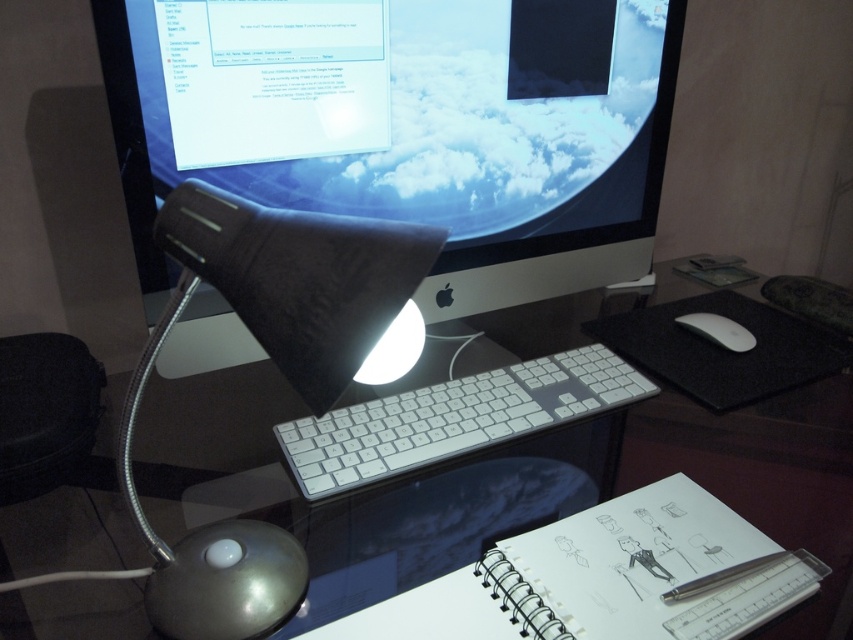
Between white matte mouse at right and metallic silver pen at lower right, which one is positioned higher?

white matte mouse at right

Image resolution: width=853 pixels, height=640 pixels. Describe the element at coordinates (718, 330) in the screenshot. I see `white matte mouse at right` at that location.

In order to click on white matte mouse at right in this screenshot , I will do `click(718, 330)`.

At what (x,y) coordinates should I click in order to perform the action: click on white matte mouse at right. Please return your answer as a coordinate pair (x, y). The width and height of the screenshot is (853, 640). Looking at the image, I should click on (718, 330).

Is the position of white aluminum keyboard at center more distant than that of white matte mouse at right?

No, it is in front of white matte mouse at right.

Describe the element at coordinates (451, 419) in the screenshot. I see `white aluminum keyboard at center` at that location.

Between point (430, 456) and point (706, 333), which one is positioned behind?

Positioned behind is point (706, 333).

Find the location of `white aluminum keyboard at center`. white aluminum keyboard at center is located at coordinates (451, 419).

Is white aluminum keyboard at center bigger than metallic silver pen at lower right?

Yes.

Consider the image. Measure the distance between white aluminum keyboard at center and camera.

white aluminum keyboard at center and camera are 26.43 inches apart from each other.

Between point (541, 410) and point (711, 586), which one is positioned in front?

Positioned in front is point (711, 586).

Find the location of `white aluminum keyboard at center`. white aluminum keyboard at center is located at coordinates (451, 419).